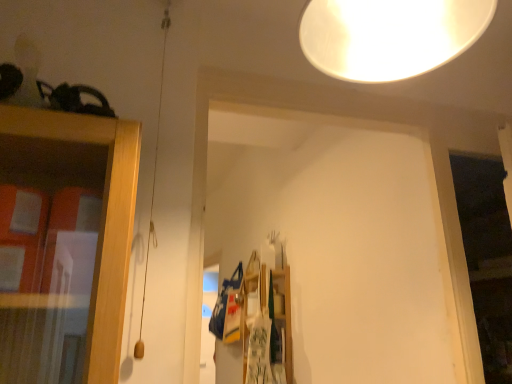
Question: Is point (266, 291) closer or farther from the camera than point (335, 41)?

Choices:
 (A) closer
 (B) farther

Answer: (B)

Question: Is wooden at center bigger or smaller than white glossy lampshade at upper center?

Choices:
 (A) big
 (B) small

Answer: (A)

Question: From a real-world perspective, relative to white glossy lampshade at upper center, is wooden at center vertically above or below?

Choices:
 (A) below
 (B) above

Answer: (A)

Question: From the image's perspective, is white glossy lampshade at upper center above or below wooden at center?

Choices:
 (A) below
 (B) above

Answer: (B)

Question: Considering the positions of white glossy lampshade at upper center and wooden at center in the image, is white glossy lampshade at upper center wider or thinner than wooden at center?

Choices:
 (A) wide
 (B) thin

Answer: (B)

Question: In terms of height, does white glossy lampshade at upper center look taller or shorter compared to wooden at center?

Choices:
 (A) short
 (B) tall

Answer: (A)

Question: Considering the positions of white glossy lampshade at upper center and wooden at center in the image, is white glossy lampshade at upper center bigger or smaller than wooden at center?

Choices:
 (A) small
 (B) big

Answer: (A)